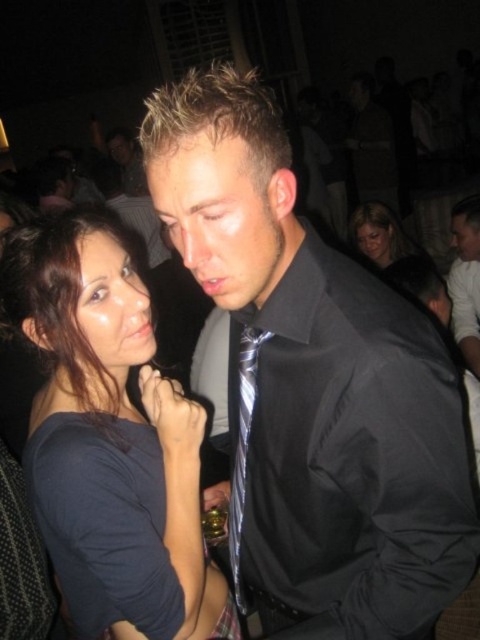
Question: Which point appears closest to the camera in this image?

Choices:
 (A) (204, 260)
 (B) (381, 240)
 (C) (245, 410)
 (D) (55, 436)

Answer: (A)

Question: Which of these objects is positioned farthest from the matte black hair at upper center?

Choices:
 (A) dark blue fabric shirt at center
 (B) silver metallic tie at center

Answer: (A)

Question: Can you confirm if silver metallic tie at center is positioned to the left of matte black hair at upper center?

Choices:
 (A) no
 (B) yes

Answer: (B)

Question: Can you confirm if black satin shirt at center is positioned to the right of silver metallic tie at center?

Choices:
 (A) yes
 (B) no

Answer: (A)

Question: Which point is farther to the camera?

Choices:
 (A) (395, 240)
 (B) (223, 608)

Answer: (A)

Question: Does dark blue fabric shirt at center appear over silver metallic tie at center?

Choices:
 (A) yes
 (B) no

Answer: (A)